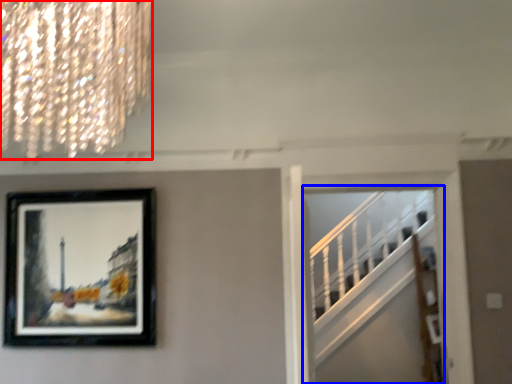
Question: Which object appears farthest to the camera in this image, lamp (highlighted by a red box) or escalator (highlighted by a blue box)?

Choices:
 (A) lamp
 (B) escalator

Answer: (B)